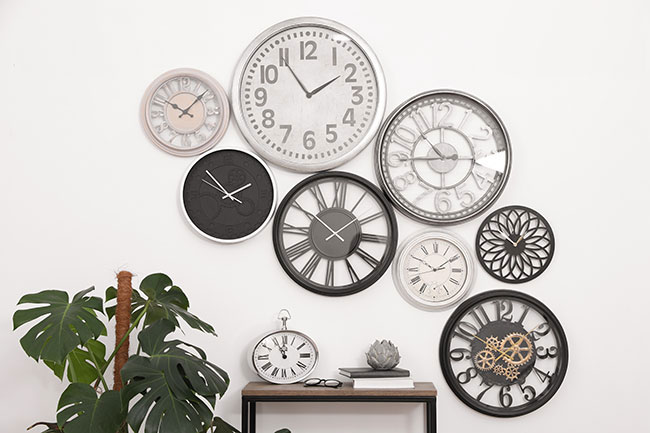
Identify the location of clock face. (x=233, y=215), (x=199, y=110), (x=272, y=100), (x=428, y=150), (x=344, y=218), (x=445, y=269), (x=499, y=245), (x=496, y=337), (x=292, y=356).